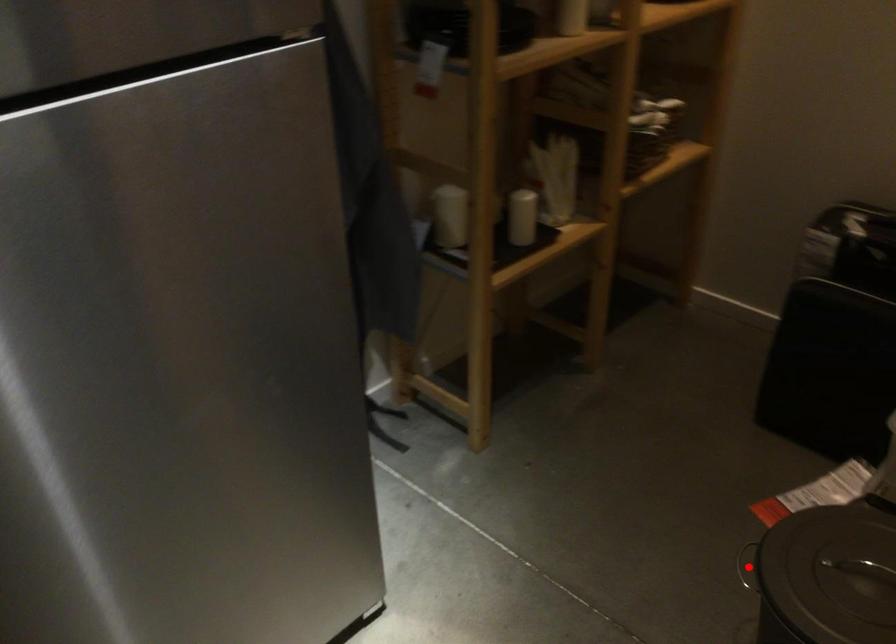
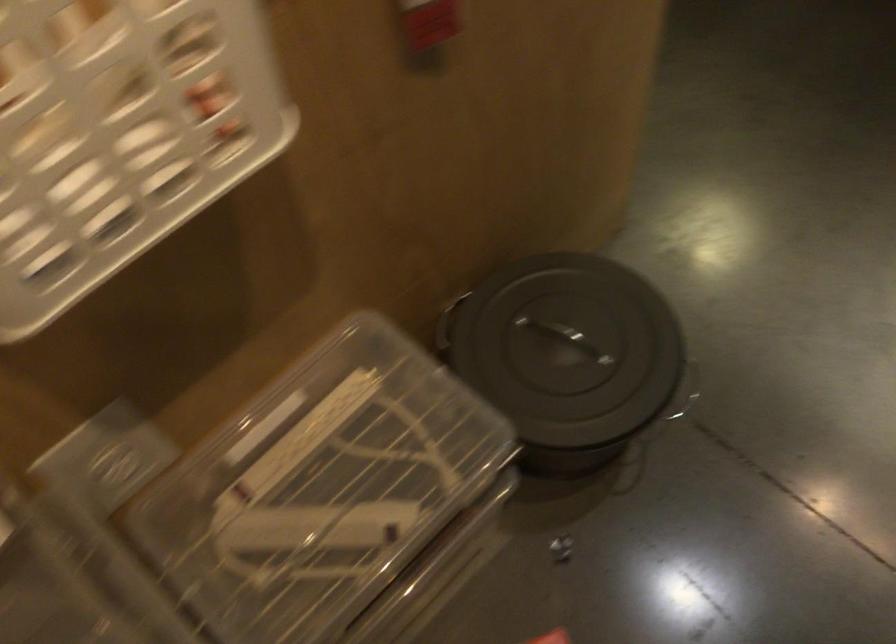
Question: I am providing you with two images of the same scene from different viewpoints. A red point is marked on the first image. Can you still see the location of the red point in image 2?

Choices:
 (A) Yes
 (B) No

Answer: (B)